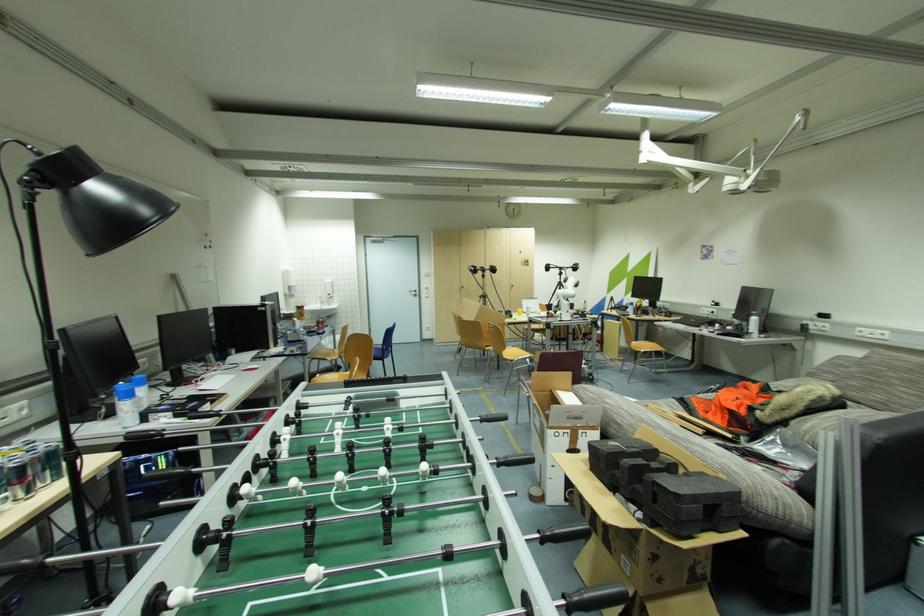
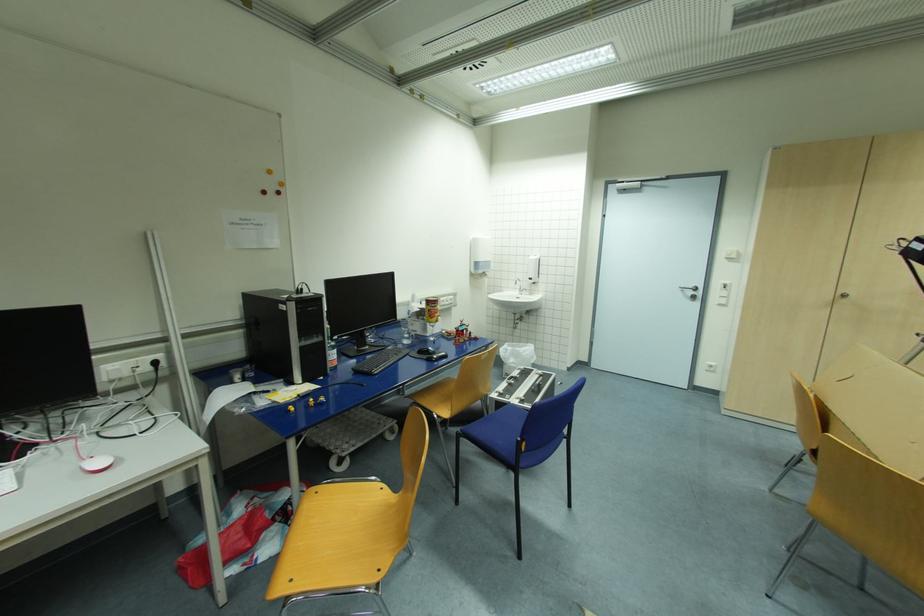
Where in the second image is the point corresponding to point 419,292 from the first image?

(699, 289)